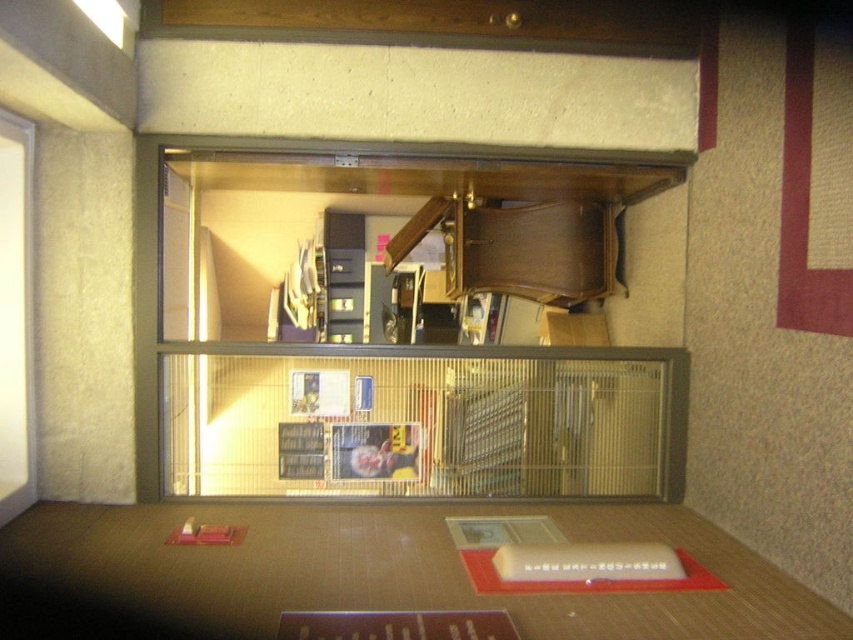
You are an interior designer planning to place a new sofa in the room. The sofa is 1.5 meters long. You see the wooden shelf at center and the wooden table at center. Which object should you consider in terms of space availability for placing the sofa?

The wooden shelf at center is bigger than the wooden table at center, so you should consider the space around the wooden shelf at center first to ensure there is enough room for the sofa.

You are a museum visitor holding a small sculpture that needs to be placed inside either the metallic wire cage at center or the wooden shelf at center. Based on their sizes, which one can accommodate the sculpture more comfortably?

The metallic wire cage at center is bigger than the wooden shelf at center, so it can accommodate the sculpture more comfortably.